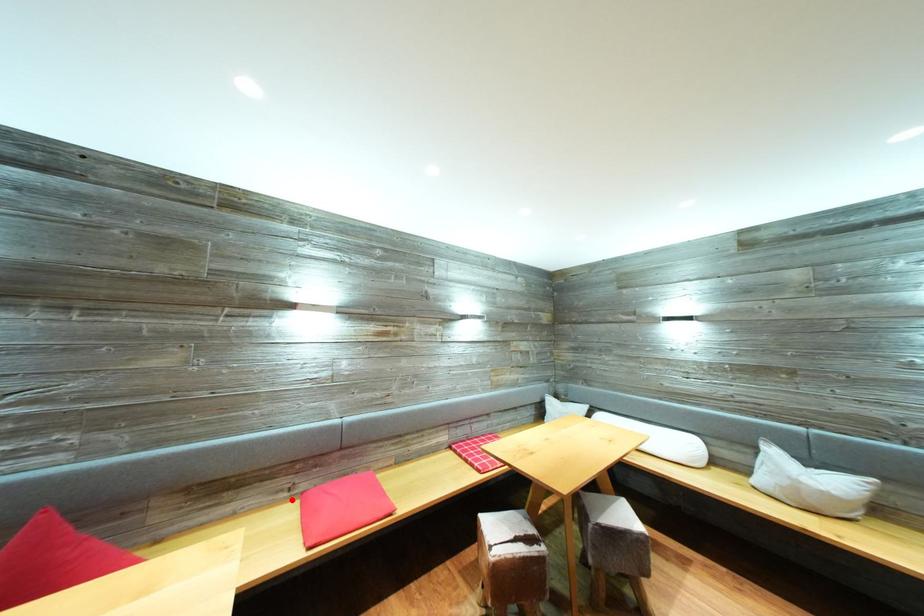
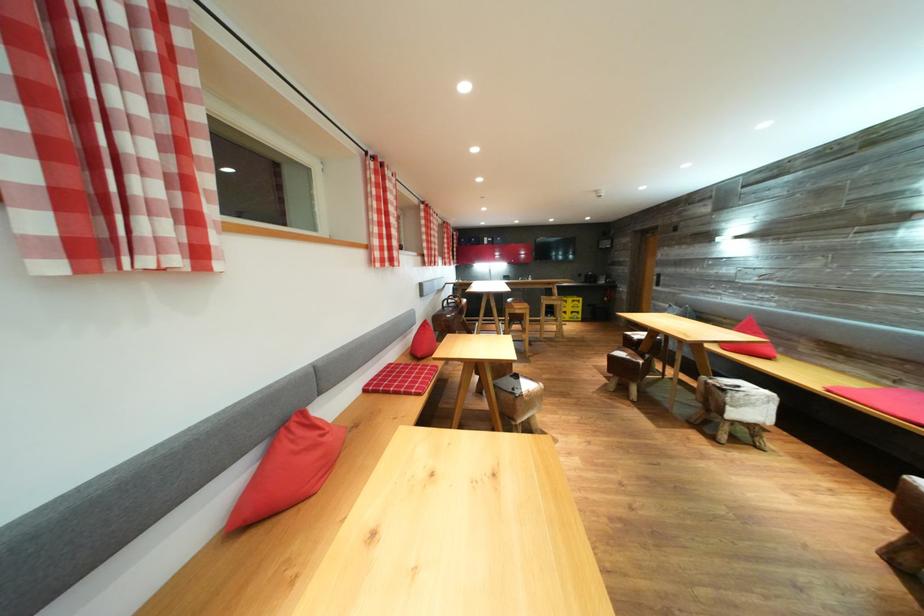
The point at the highlighted location is marked in the first image. Where is the corresponding point in the second image?

(895, 389)